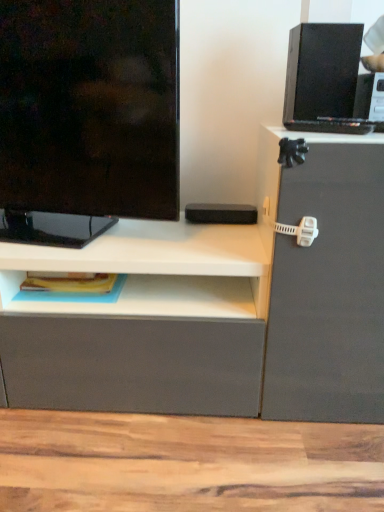
Question: Is black matte speaker at upper right placed right next to matte black television at left?

Choices:
 (A) no
 (B) yes

Answer: (A)

Question: Considering the relative sizes of black matte speaker at upper right and matte black television at left in the image provided, is black matte speaker at upper right taller than matte black television at left?

Choices:
 (A) yes
 (B) no

Answer: (B)

Question: Is black matte speaker at upper right positioned in front of matte black television at left?

Choices:
 (A) yes
 (B) no

Answer: (B)

Question: Does black matte speaker at upper right have a lesser height compared to matte black television at left?

Choices:
 (A) yes
 (B) no

Answer: (A)

Question: From the image's perspective, is black matte speaker at upper right located beneath matte black television at left?

Choices:
 (A) no
 (B) yes

Answer: (A)

Question: Can you confirm if black matte speaker at upper right is thinner than matte black television at left?

Choices:
 (A) yes
 (B) no

Answer: (B)

Question: From a real-world perspective, is matte black television at left located higher than black matte speaker at upper right?

Choices:
 (A) no
 (B) yes

Answer: (A)

Question: Does matte black television at left have a lesser width compared to black matte speaker at upper right?

Choices:
 (A) yes
 (B) no

Answer: (A)

Question: Is matte black television at left positioned with its back to black matte speaker at upper right?

Choices:
 (A) no
 (B) yes

Answer: (A)

Question: Is matte black television at left to the right of black matte speaker at upper right from the viewer's perspective?

Choices:
 (A) yes
 (B) no

Answer: (B)

Question: Is matte black television at left far away from black matte speaker at upper right?

Choices:
 (A) no
 (B) yes

Answer: (A)

Question: Is matte black television at left located outside black matte speaker at upper right?

Choices:
 (A) yes
 (B) no

Answer: (A)

Question: In terms of size, does matte black television at left appear bigger or smaller than black matte speaker at upper right?

Choices:
 (A) big
 (B) small

Answer: (A)